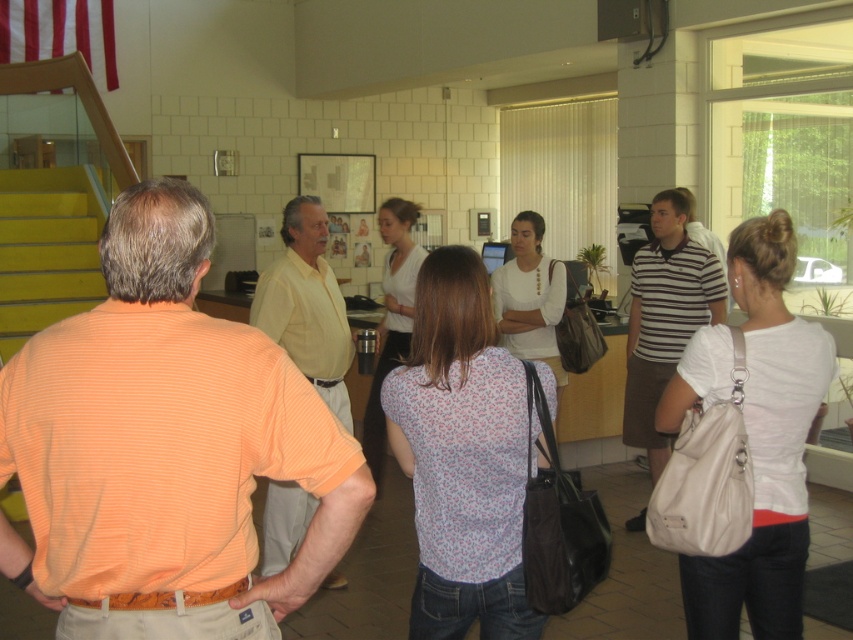
You are a photographer trying to capture a group photo of the orange striped shirt at center and the yellow smooth shirt at center. The camera you are using has a maximum focus range of 8 feet. Will both subjects be in focus if you position yourself exactly between them?

The distance between the orange striped shirt at center and yellow smooth shirt at center is 7.79 feet. Since the camera can focus up to 8 feet, positioning yourself exactly between them would mean each subject is about 3.895 feet away from the camera. This distance is within the camera maximum focus range of 8 feet, so both subjects will be in focus.

You are organizing a photo shoot and need to arrange two models wearing the yellow smooth shirt at center and the striped cotton polo shirt at center. According to the scene, which model should stand to the left to match the original image?

The model wearing the yellow smooth shirt at center should stand to the left since the yellow smooth shirt at center is positioned on the left side of the striped cotton polo shirt at center in the original image.

Based on the photo, you are standing at the point labeled point (670, 204) and want to move to the exit door located at point (48, 486). Can you walk directly towards the exit without any obstacles blocking your path?

Yes, you can walk directly towards the exit because point (48, 486) is in front of point (670, 204), meaning there is a clear path between them.